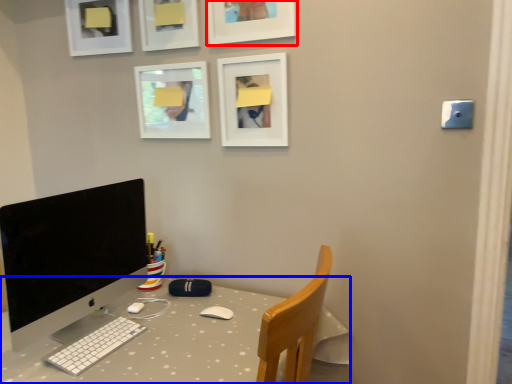
Question: Among these objects, which one is nearest to the camera, picture frame (highlighted by a red box) or desk (highlighted by a blue box)?

Choices:
 (A) picture frame
 (B) desk

Answer: (B)